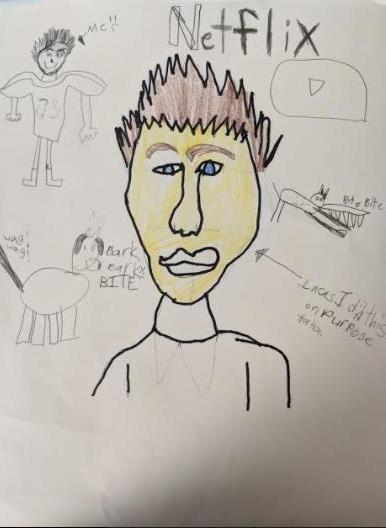
Identify the location of chest. (204, 380).